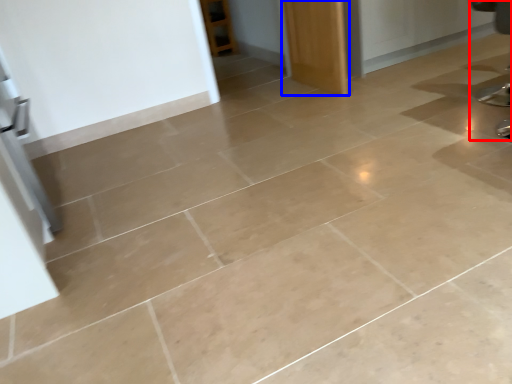
Question: Which of the following is the farthest to the observer, swivel chair (highlighted by a red box) or door (highlighted by a blue box)?

Choices:
 (A) swivel chair
 (B) door

Answer: (B)